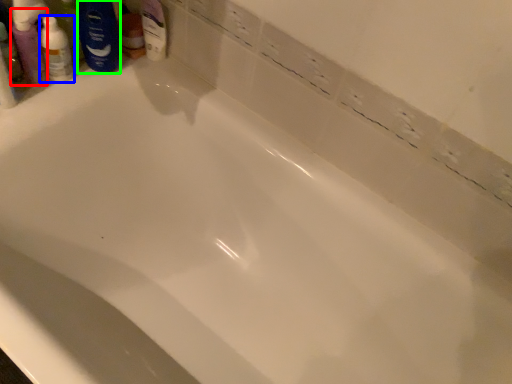
Question: Which object is the closest to the mouthwash (highlighted by a red box)? Choose among these: toiletry (highlighted by a blue box) or shaving cream (highlighted by a green box).

Choices:
 (A) toiletry
 (B) shaving cream

Answer: (A)